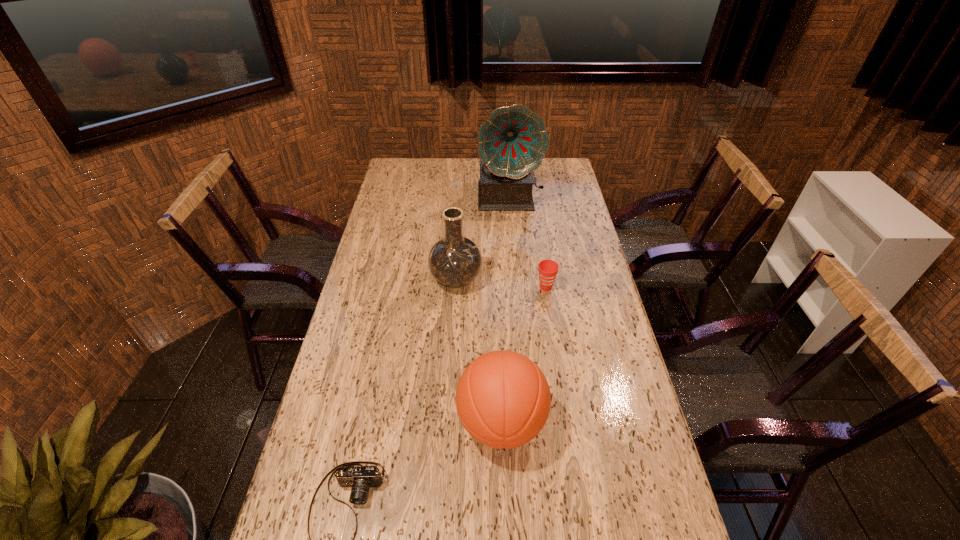
The width and height of the screenshot is (960, 540). In order to click on record player in this screenshot , I will do (512, 143).

Identify the location of the farthest object. This screenshot has height=540, width=960. (512, 143).

This screenshot has height=540, width=960. Find the location of `vase`. vase is located at coordinates (455, 261).

You are a GUI agent. You are given a task and a screenshot of the screen. Output one action in this format:
    pyautogui.click(x=<x>, y=<y>)
    Task: Click on the basketball
    The height and width of the screenshot is (540, 960).
    Given the screenshot: What is the action you would take?
    pyautogui.click(x=503, y=399)

Find the location of a particular element. The image size is (960, 540). cup is located at coordinates (548, 269).

Find the location of a particular element. vacant region located on the horn of the farthest object is located at coordinates (516, 270).

I want to click on vacant space located 0.250m on the back of the second tallest object, so click(x=459, y=224).

What are the coordinates of `vacant region located on the left of the third tallest object` in the screenshot? It's located at point(416,423).

At what (x,y) coordinates should I click in order to perform the action: click on free space located 0.240m on the left of the cup. Please return your answer as a coordinate pair (x, y). Looking at the image, I should click on (468, 287).

Locate an element on the screen. This screenshot has width=960, height=540. object located in the far edge section of the desktop is located at coordinates (512, 143).